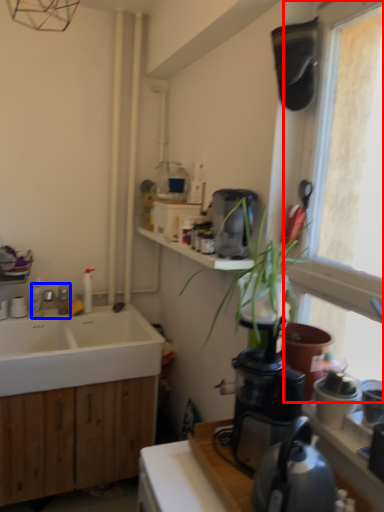
Question: Which object is closer to the camera taking this photo, window (highlighted by a red box) or tap (highlighted by a blue box)?

Choices:
 (A) window
 (B) tap

Answer: (A)